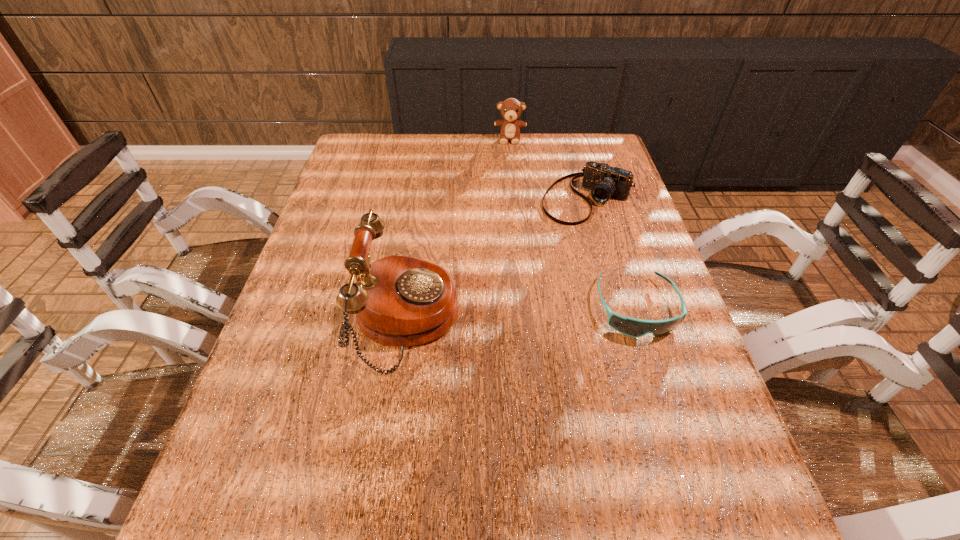
Find the location of a particular element. free space between the tallest object and the third shortest object is located at coordinates (459, 229).

Locate an element on the screen. The width and height of the screenshot is (960, 540). blank region between the camera and the leftmost object is located at coordinates coord(497,259).

Choose which object is the nearest neighbor to the teddy bear. Please provide its 2D coordinates. Your answer should be formatted as a tuple, i.e. [(x, y)], where the tuple contains the x and y coordinates of a point satisfying the conditions above.

[(604, 181)]

You are a GUI agent. You are given a task and a screenshot of the screen. Output one action in this format:
    pyautogui.click(x=<x>, y=<y>)
    Task: Click on the object that ranks as the closest to the shortest object
    
    Given the screenshot: What is the action you would take?
    pyautogui.click(x=604, y=181)